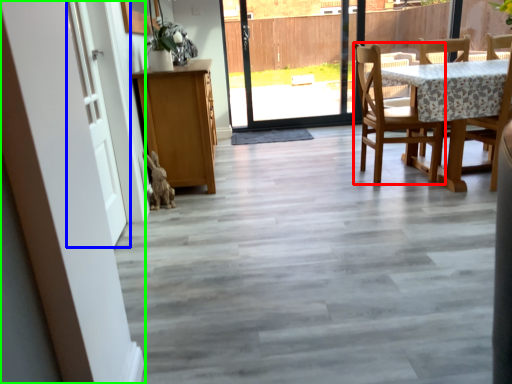
Question: Considering the real-world distances, which object is closest to chair (highlighted by a red box)? door (highlighted by a blue box) or barn door (highlighted by a green box).

Choices:
 (A) door
 (B) barn door

Answer: (A)